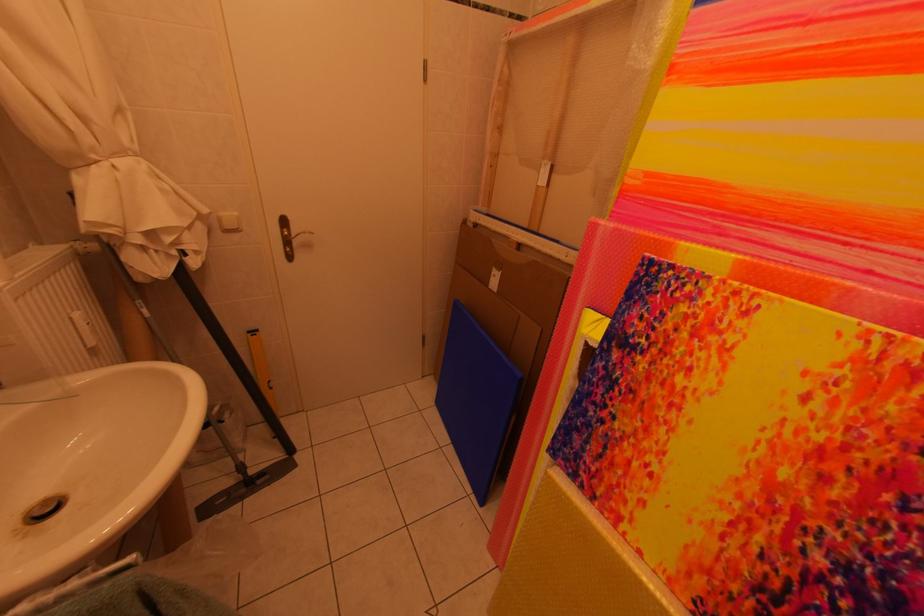
This screenshot has width=924, height=616. I want to click on white radiator knob, so click(x=83, y=329).